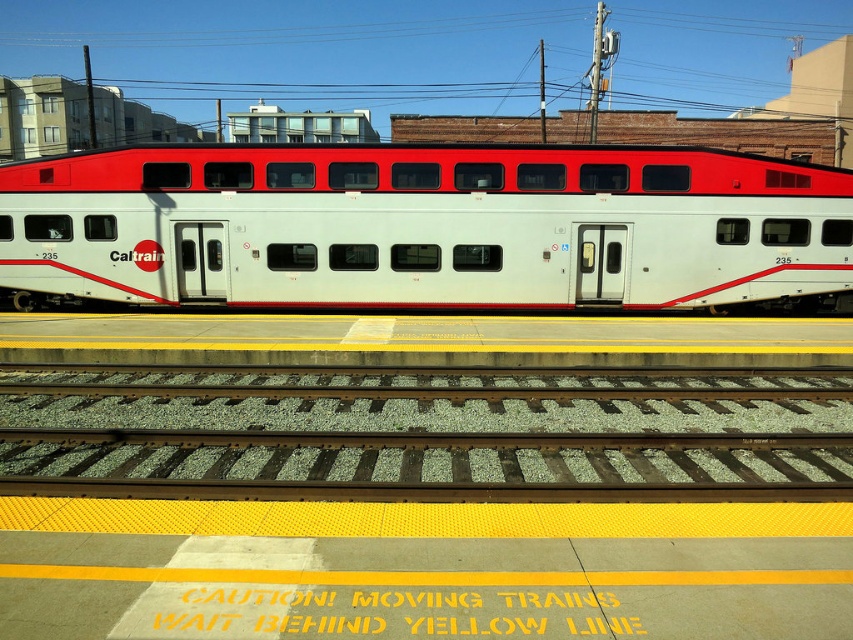
Consider the image. Between white matte train car at center and green gravel track at center, which one appears on the right side from the viewer's perspective?

green gravel track at center is more to the right.

Between point (345, 202) and point (363, 456), which one is positioned in front?

Point (363, 456) is more forward.

Who is more forward, (344, 211) or (799, 492)?

Point (799, 492) is more forward.

The width and height of the screenshot is (853, 640). In order to click on white matte train car at center in this screenshot , I will do `click(424, 227)`.